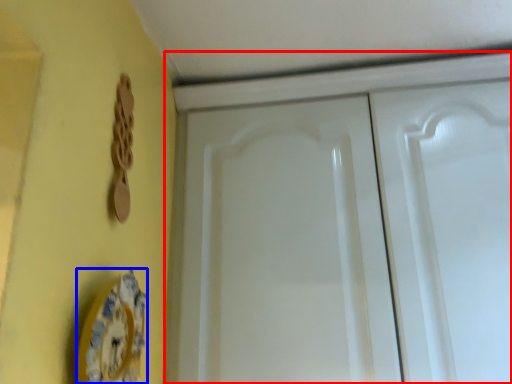
Question: Which of the following is the closest to the observer, cabinetry (highlighted by a red box) or plate (highlighted by a blue box)?

Choices:
 (A) cabinetry
 (B) plate

Answer: (B)